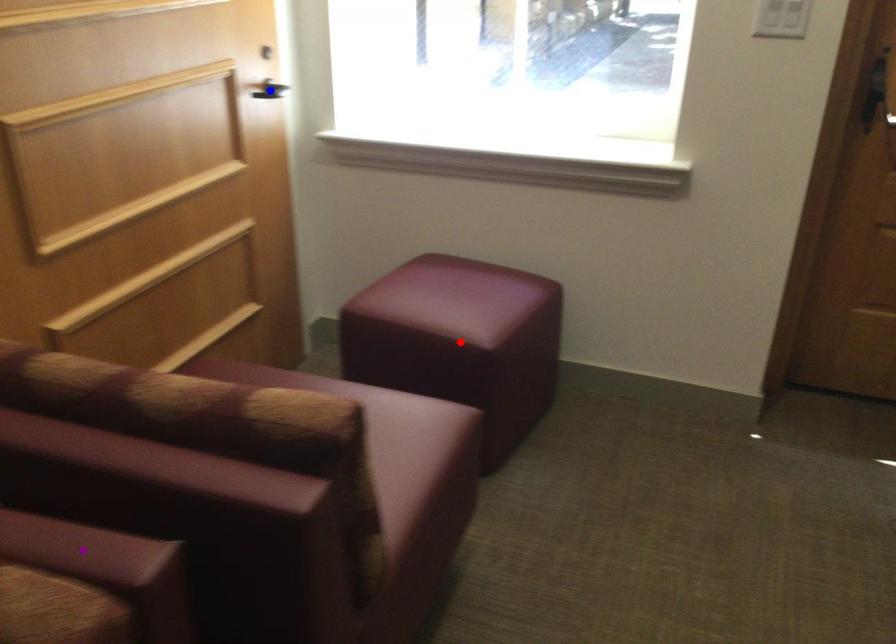
Order these from farthest to nearest:
A) blue point
B) red point
C) purple point

blue point
red point
purple point